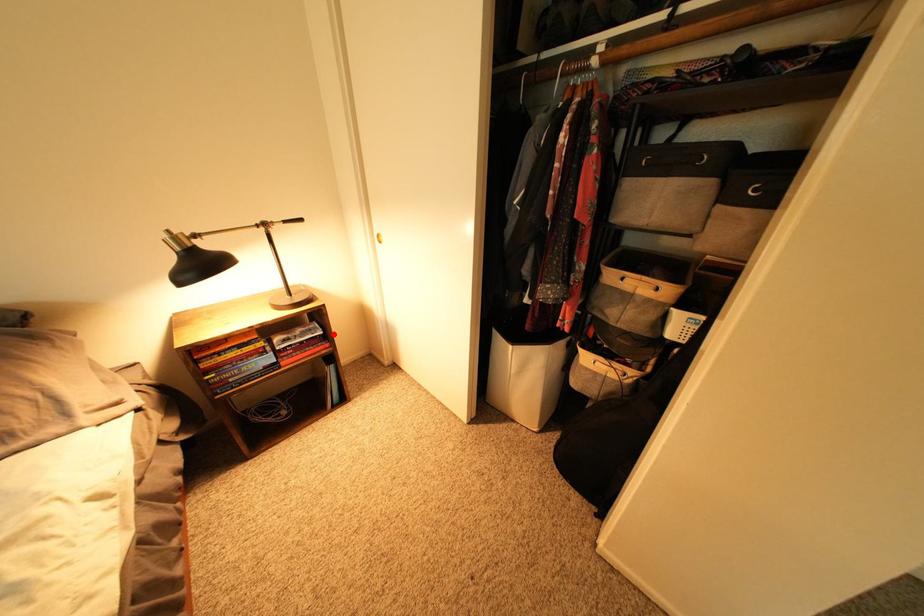
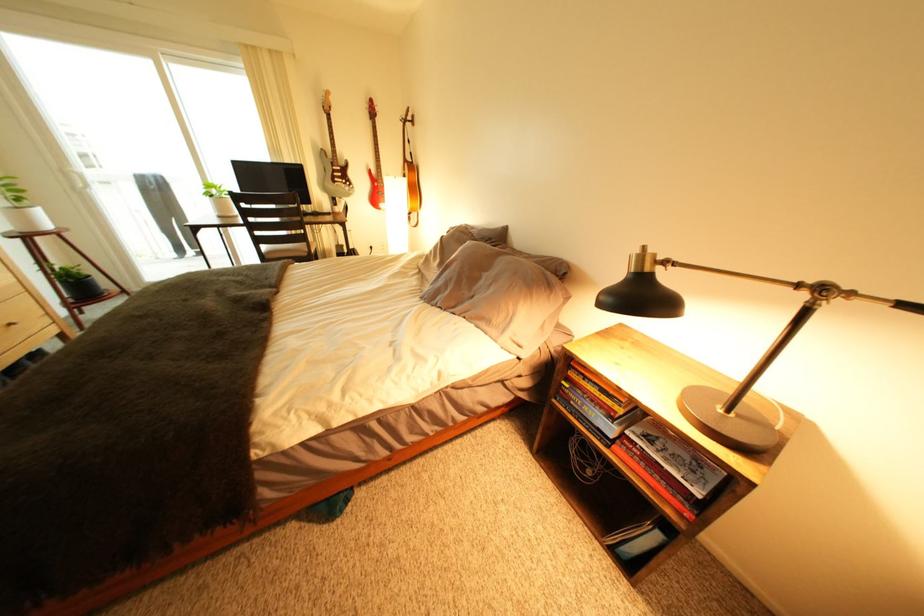
Question: I am providing you with two images of the same scene from different viewpoints. A red point is shown in image1. For the corresponding object point in image2, is it positioned nearer or farther from the camera?

Choices:
 (A) Nearer
 (B) Farther

Answer: (B)